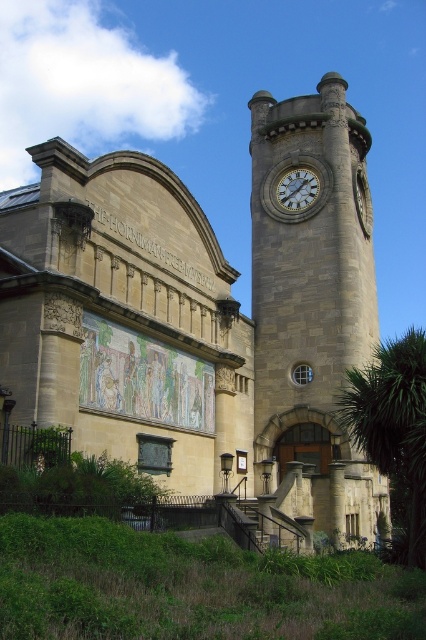
You are a visitor standing in front of the Horniman Museum. You notice the stone clock tower at center and the white stone clock at upper center. Which of these two objects is larger in size?

The stone clock tower at center is bigger than the white stone clock at upper center.

You are standing in front of the Horniman Museum and want to locate the entrance. You notice the stone clock tower at center and the white stone clock at upper center. Based on their positions, which object is closer to the ground level?

The stone clock tower at center is closer to the ground level because it is positioned below the white stone clock at upper center.

Looking at this image, you are standing at the entrance of the Horniman Museum and want to take a photo of both the stone clock tower at center and the white stone clock at upper center in the same frame. Considering their distance apart, will you need to zoom in or zoom out your camera to include both objects in the shot?

The stone clock tower at center is 19.04 feet away from the white stone clock at upper center. To include both in the same frame, you would need to zoom out to capture the distance between them.